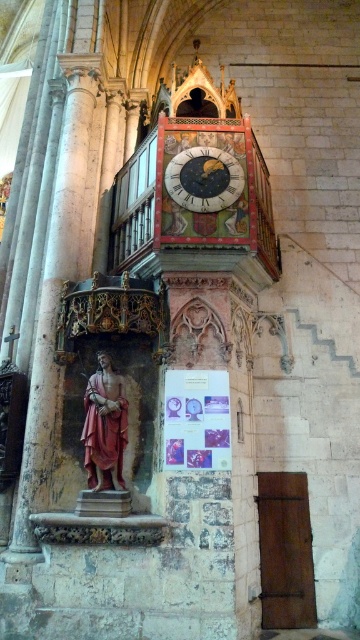
Question: Can you confirm if white marble column at left is positioned below gold textured clock at center?

Choices:
 (A) no
 (B) yes

Answer: (B)

Question: Which point is farther to the camera?

Choices:
 (A) (16, 492)
 (B) (198, 157)
 (C) (86, 465)

Answer: (B)

Question: From the image, what is the correct spatial relationship of white marble column at left in relation to gold textured clock at center?

Choices:
 (A) right
 (B) left

Answer: (B)

Question: Among these objects, which one is farthest from the camera?

Choices:
 (A) white marble column at left
 (B) gold textured clock at center

Answer: (B)

Question: Which point is farther to the camera?

Choices:
 (A) (240, 189)
 (B) (69, 273)
 (C) (88, 468)

Answer: (B)

Question: From the image, what is the correct spatial relationship of white marble column at left in relation to matte pink statue at center?

Choices:
 (A) below
 (B) above

Answer: (B)